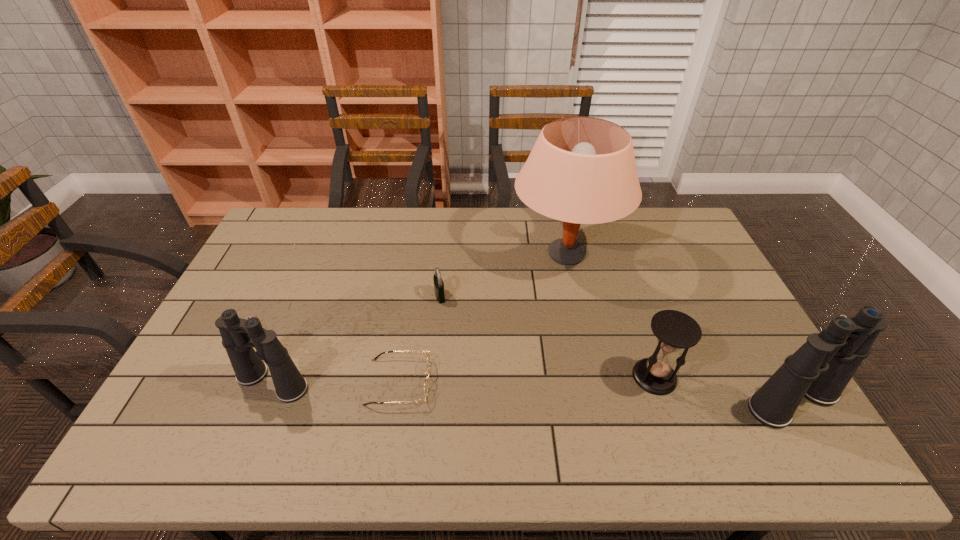
The height and width of the screenshot is (540, 960). In order to click on free space for an extra binoculars to achieve even spacing in this screenshot , I will do `click(528, 392)`.